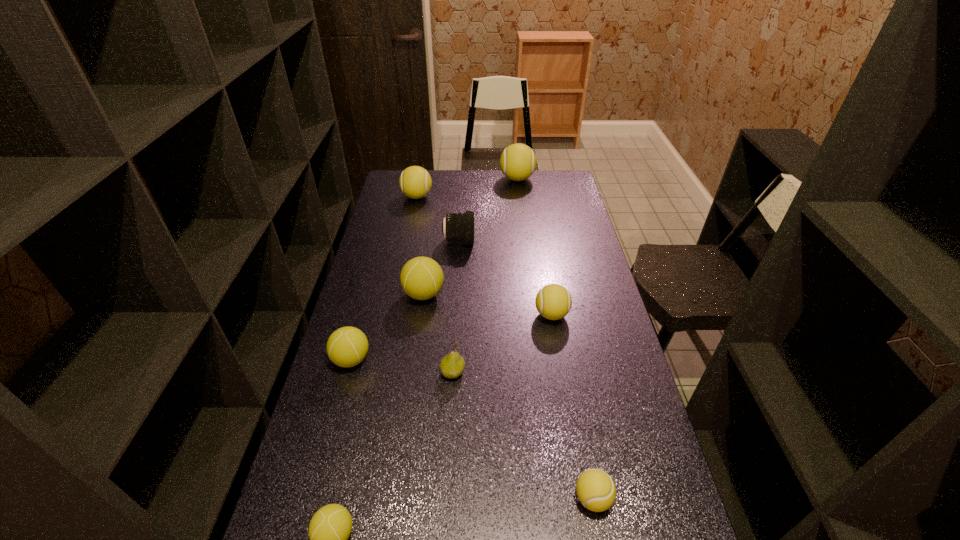
Find the location of a particular element. This screenshot has width=960, height=540. the second farthest green tennis ball is located at coordinates (346, 347).

This screenshot has width=960, height=540. I want to click on the second biggest green tennis ball, so (346, 347).

Find the location of a particular element. Image resolution: width=960 pixels, height=540 pixels. the nearest yellow tennis ball is located at coordinates (595, 489).

Where is `blank area located 0.330m on the left of the tallest object`? blank area located 0.330m on the left of the tallest object is located at coordinates (433, 179).

The width and height of the screenshot is (960, 540). I want to click on vacant area located on the right of the eighth nearest object, so click(x=450, y=197).

Locate an element on the screen. This screenshot has width=960, height=540. vacant space positioned on the front of the farthest green tennis ball is located at coordinates (409, 403).

The width and height of the screenshot is (960, 540). Find the location of `free space located at the front element of the telephoto lens`. free space located at the front element of the telephoto lens is located at coordinates (520, 241).

The height and width of the screenshot is (540, 960). Find the location of `free space located on the front of the green pear`. free space located on the front of the green pear is located at coordinates (448, 455).

The height and width of the screenshot is (540, 960). Find the location of `free location located on the back of the third biggest yellow tennis ball`. free location located on the back of the third biggest yellow tennis ball is located at coordinates point(540,248).

You are a GUI agent. You are given a task and a screenshot of the screen. Output one action in this format:
    pyautogui.click(x=<x>, y=<y>)
    Task: Click on the blank space located on the front of the second smallest green tennis ball
    The width and height of the screenshot is (960, 540).
    Given the screenshot: What is the action you would take?
    pyautogui.click(x=329, y=438)